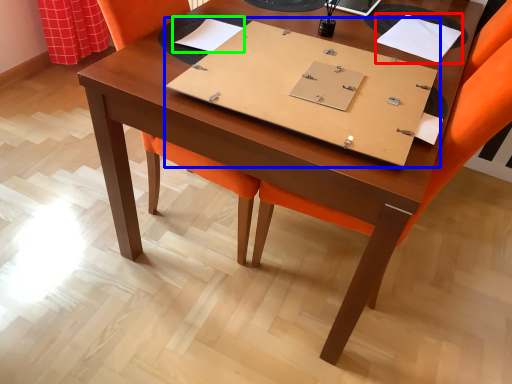
Question: Which object is positioned closest to notebook (highlighted by a red box)? Select from notebook (highlighted by a blue box) and notebook (highlighted by a green box).

Choices:
 (A) notebook
 (B) notebook

Answer: (A)